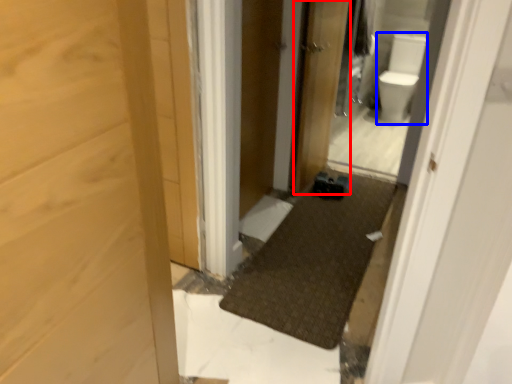
Question: Which point is closer to the camera, door (highlighted by a red box) or toilet bowl (highlighted by a blue box)?

Choices:
 (A) door
 (B) toilet bowl

Answer: (A)